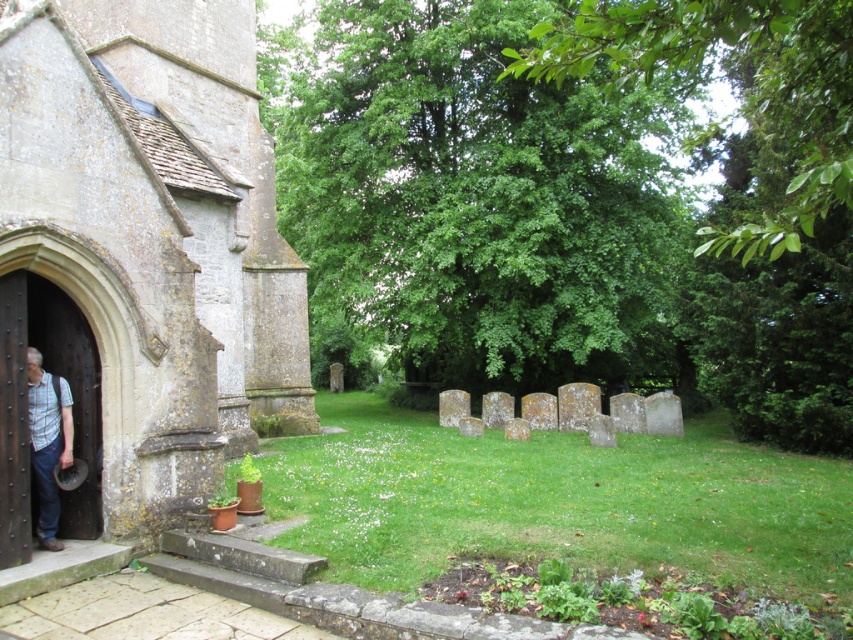
Is wooden door at left shorter than dark brown wooden door at left?

No.

Measure the distance between wooden door at left and camera.

wooden door at left and camera are 8.93 meters apart from each other.

You are a GUI agent. You are given a task and a screenshot of the screen. Output one action in this format:
    pyautogui.click(x=<x>, y=<y>)
    Task: Click on the wooden door at left
    This screenshot has height=640, width=853.
    Given the screenshot: What is the action you would take?
    pyautogui.click(x=73, y=394)

This screenshot has height=640, width=853. Find the location of `stone church at left`. stone church at left is located at coordinates (140, 259).

Describe the element at coordinates (140, 259) in the screenshot. I see `stone church at left` at that location.

Identify the location of stone church at left. This screenshot has height=640, width=853. (140, 259).

Is dark brown wooden door at left shorter than plaid shirt at left?

Incorrect, dark brown wooden door at left's height does not fall short of plaid shirt at left's.

Is dark brown wooden door at left taller than plaid shirt at left?

Yes.

Between point (16, 433) and point (26, 364), which one is positioned behind?

Positioned behind is point (26, 364).

The height and width of the screenshot is (640, 853). In order to click on dark brown wooden door at left in this screenshot , I will do 13,422.